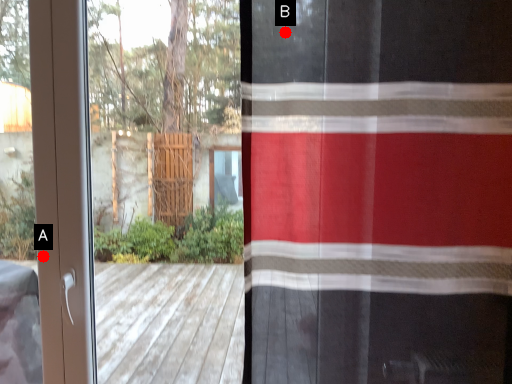
Question: Two points are circled on the image, labeled by A and B beside each circle. Which point appears farthest from the camera in this image?

Choices:
 (A) A is further
 (B) B is further

Answer: (A)